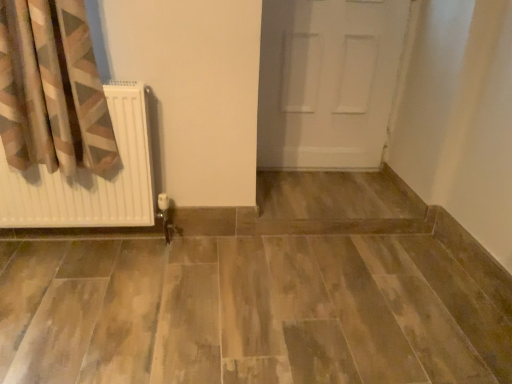
Question: Considering the positions of white matte radiator at left and white matte door at center in the image, is white matte radiator at left bigger or smaller than white matte door at center?

Choices:
 (A) big
 (B) small

Answer: (B)

Question: Considering the positions of white matte radiator at left and white matte door at center in the image, is white matte radiator at left wider or thinner than white matte door at center?

Choices:
 (A) wide
 (B) thin

Answer: (A)

Question: In terms of height, does white matte radiator at left look taller or shorter compared to white matte door at center?

Choices:
 (A) short
 (B) tall

Answer: (A)

Question: Relative to white matte radiator at left, is white matte door at center in front or behind?

Choices:
 (A) front
 (B) behind

Answer: (B)

Question: Is point (361, 160) positioned closer to the camera than point (80, 173)?

Choices:
 (A) farther
 (B) closer

Answer: (A)

Question: Which is correct: white matte door at center is inside white matte radiator at left, or outside of it?

Choices:
 (A) outside
 (B) inside

Answer: (A)

Question: Looking at their shapes, would you say white matte door at center is wider or thinner than white matte radiator at left?

Choices:
 (A) wide
 (B) thin

Answer: (B)